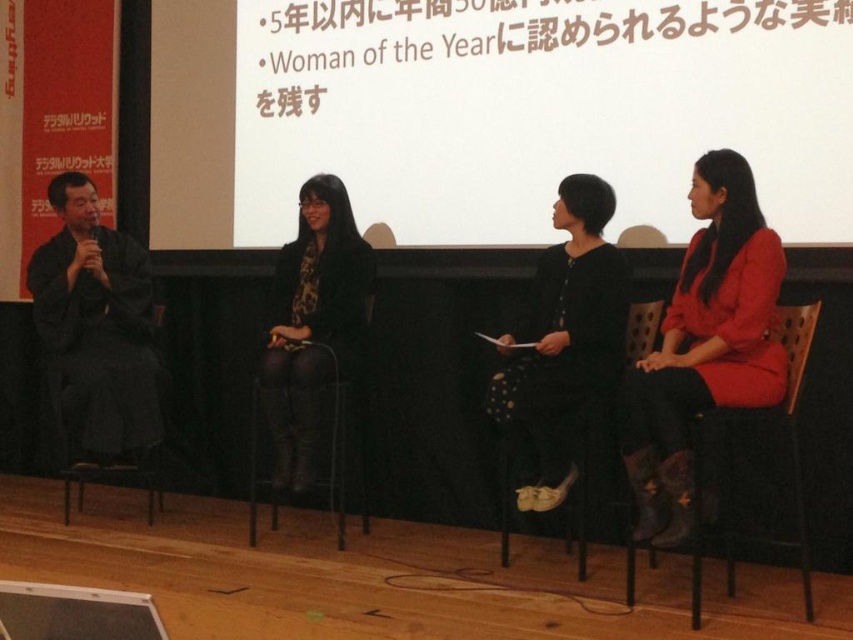
Does brown wooden chair at right appear on the right side of black fabric chair at center?

Correct, you'll find brown wooden chair at right to the right of black fabric chair at center.

Does brown wooden chair at right have a lesser height compared to black fabric chair at center?

No, brown wooden chair at right is not shorter than black fabric chair at center.

Where is `brown wooden chair at right`? brown wooden chair at right is located at coordinates (737, 470).

The width and height of the screenshot is (853, 640). Identify the location of brown wooden chair at right. (737, 470).

The height and width of the screenshot is (640, 853). What do you see at coordinates (538, 109) in the screenshot?
I see `white matte projection screen at upper center` at bounding box center [538, 109].

How distant is white matte projection screen at upper center from brown wooden chair at right?

A distance of 4.67 feet exists between white matte projection screen at upper center and brown wooden chair at right.

The image size is (853, 640). In order to click on white matte projection screen at upper center in this screenshot , I will do `click(538, 109)`.

In order to click on white matte projection screen at upper center in this screenshot , I will do `click(538, 109)`.

Between silk kimono at left and black fabric chair at center, which one has more height?

Standing taller between the two is silk kimono at left.

Between silk kimono at left and black fabric chair at center, which one is positioned higher?

Positioned higher is silk kimono at left.

Where is `silk kimono at left`? This screenshot has width=853, height=640. silk kimono at left is located at coordinates (96, 328).